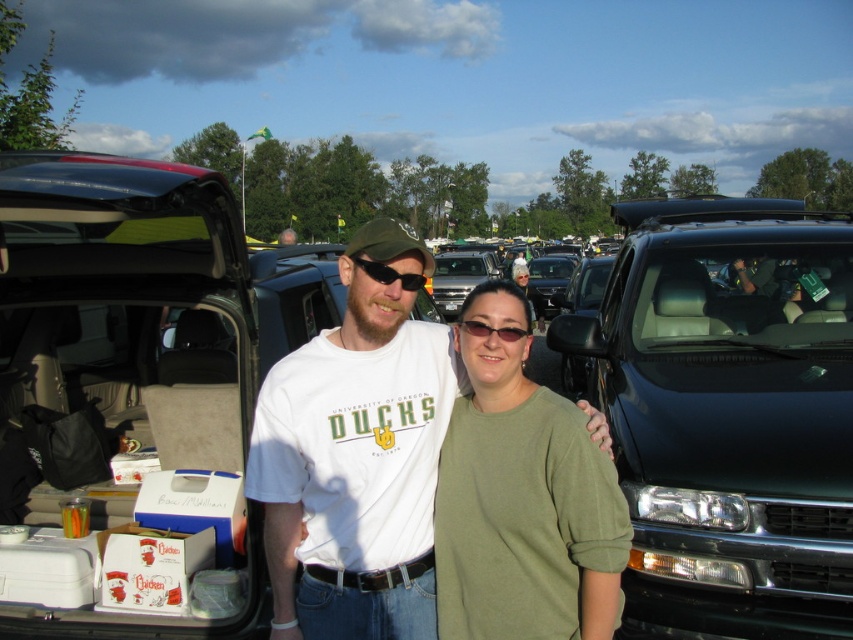
You are a photographer trying to capture a photo of the shiny black pickup truck at center and the black matte sunglasses at center. Since you want to focus on the truck, which object should you adjust your camera to prioritize in terms of depth of field?

The shiny black pickup truck at center is closer to the viewer than the black matte sunglasses at center. Therefore, to prioritize the truck in the depth of field, you should focus on the shiny black pickup truck at center.

You are a photographer trying to capture a clear shot of the two people at the tailgate event. You notice both the black matte sunglasses at center and the matte black sunglasses at center. Which pair of sunglasses appears bigger in your photo?

The black matte sunglasses at center appears bigger in the photo because it has a larger size compared to the matte black sunglasses at center.